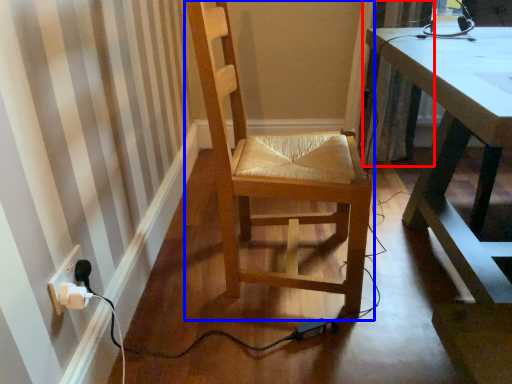
Question: Which object appears closest to the camera in this image, curtain (highlighted by a red box) or chair (highlighted by a blue box)?

Choices:
 (A) curtain
 (B) chair

Answer: (B)